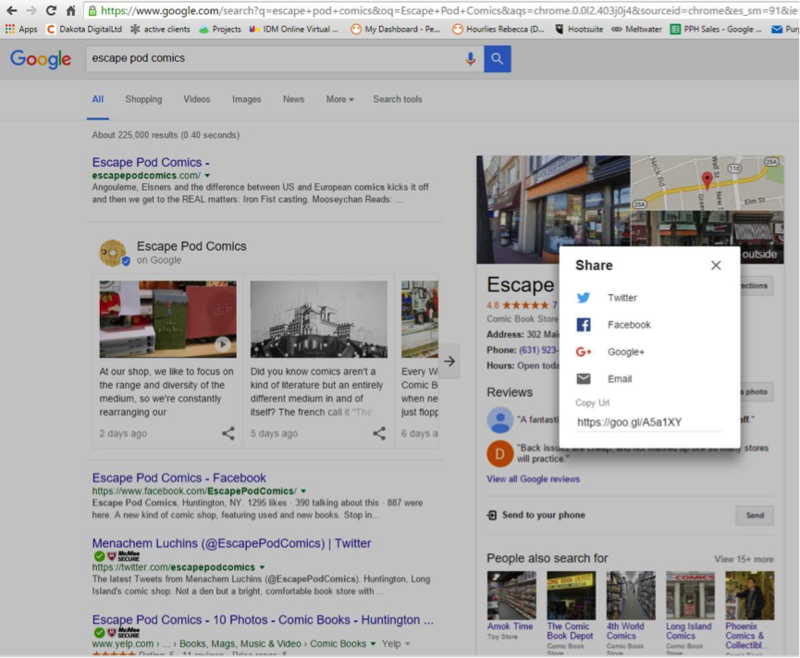
Where is `photographs`? The image size is (800, 658). photographs is located at coordinates (148, 305), (304, 320), (410, 315), (514, 201), (726, 226), (522, 603), (585, 594), (630, 595), (694, 599), (757, 603).